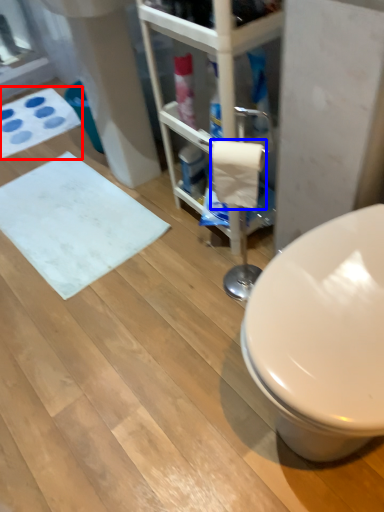
Question: Among these objects, which one is farthest to the camera, bath mat (highlighted by a red box) or toilet paper (highlighted by a blue box)?

Choices:
 (A) bath mat
 (B) toilet paper

Answer: (A)